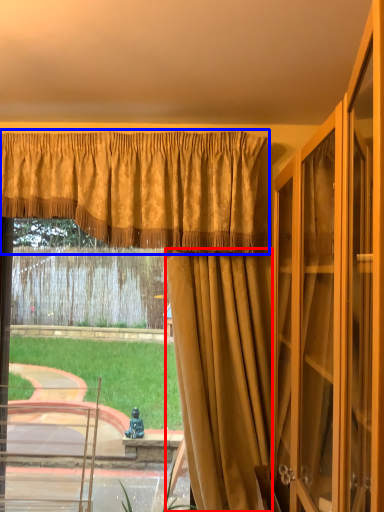
Question: Among these objects, which one is nearest to the camera, curtain (highlighted by a red box) or curtain (highlighted by a blue box)?

Choices:
 (A) curtain
 (B) curtain

Answer: (A)